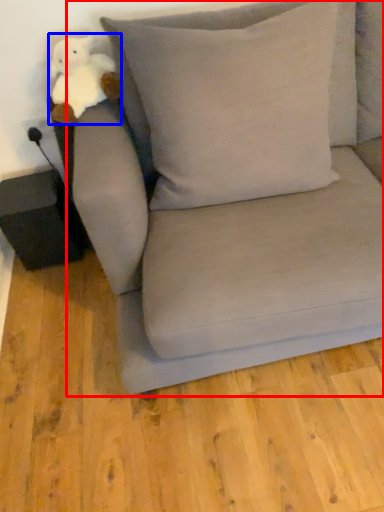
Question: Which object appears farthest to the camera in this image, studio couch (highlighted by a red box) or toy (highlighted by a blue box)?

Choices:
 (A) studio couch
 (B) toy

Answer: (B)